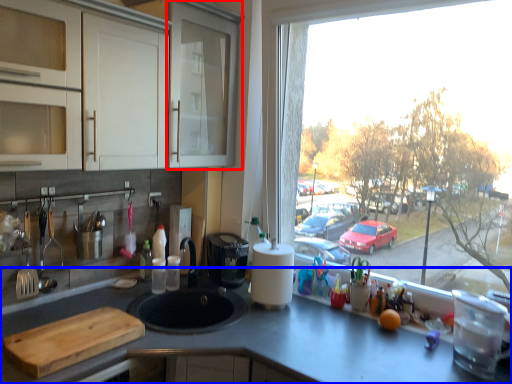
Question: Which of the following is the closest to the observer, screen door (highlighted by a red box) or countertop (highlighted by a blue box)?

Choices:
 (A) screen door
 (B) countertop

Answer: (B)